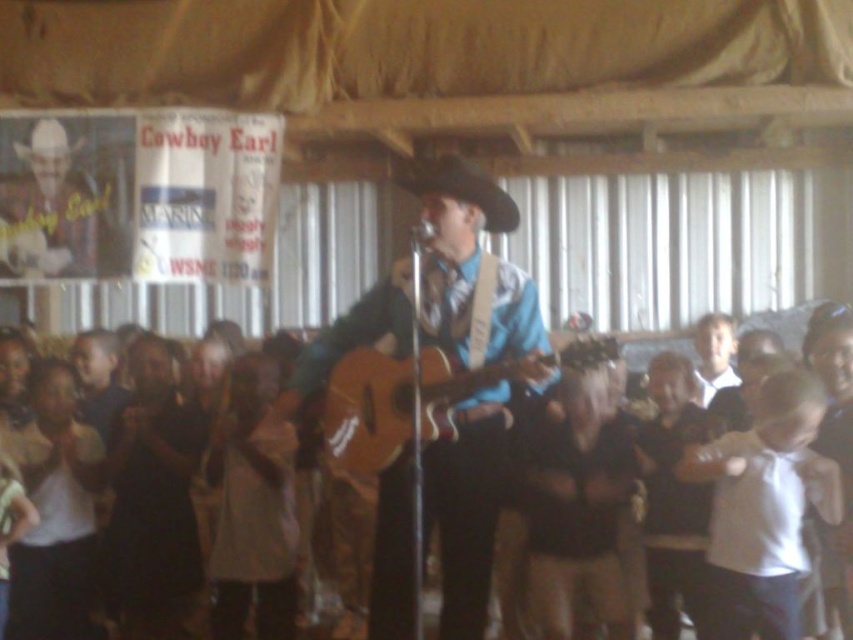
Is white matte shirt at lower right above black felt cowboy hat at center?

No.

Does point (759, 468) come closer to viewer compared to point (410, 186)?

No, it is behind (410, 186).

Image resolution: width=853 pixels, height=640 pixels. What are the coordinates of `white matte shirt at lower right` in the screenshot? It's located at (764, 508).

Where is `white matte shirt at lower right`? white matte shirt at lower right is located at coordinates (764, 508).

Who is higher up, wooden acoustic guitar at center or wooden guitar at center?

Positioned higher is wooden guitar at center.

Who is positioned more to the right, wooden acoustic guitar at center or wooden guitar at center?

From the viewer's perspective, wooden acoustic guitar at center appears more on the right side.

The width and height of the screenshot is (853, 640). Identify the location of wooden acoustic guitar at center. (471, 268).

Can you confirm if white matte shirt at lower right is smaller than white felt cowboy hat at upper left?

No, white matte shirt at lower right is not smaller than white felt cowboy hat at upper left.

Who is higher up, white matte shirt at lower right or white felt cowboy hat at upper left?

white felt cowboy hat at upper left

Identify the location of white matte shirt at lower right. (764, 508).